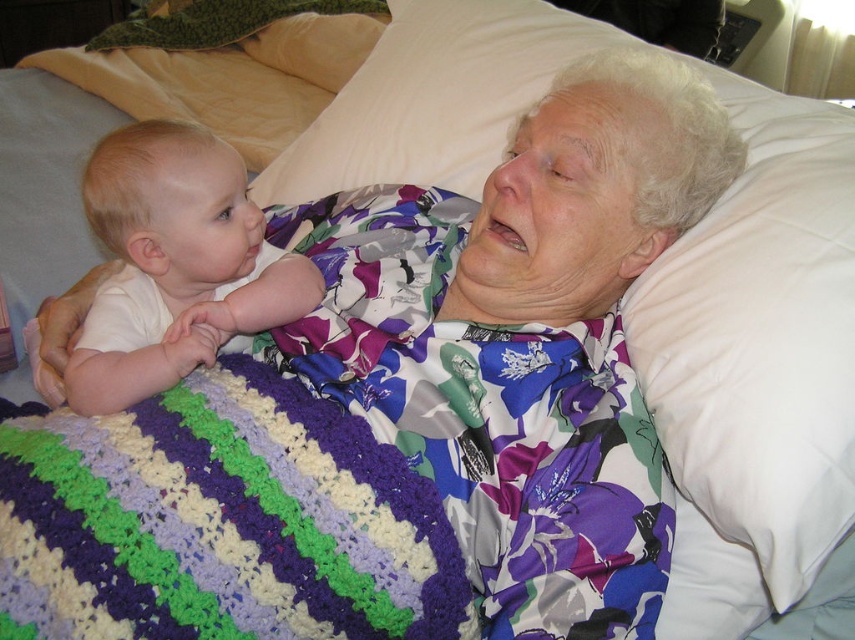
You are standing in the room and want to move from the point at coordinates point (423, 497) to the point at coordinates point (239, 316). Which direction should you move to get closer to the second point?

To move from point (423, 497) to point (239, 316), you should move towards the direction of the point at (239, 316). Since point (423, 497) is in front of point (239, 316), you need to move backward to reach the second point.

From the picture: You are a caregiver in a nursing home. You need to check if the white smooth baby at left is covered by the multicolored crocheted blanket at lower left. Based on the scene description, can you confirm if the baby is under the blanket?

The multicolored crocheted blanket at lower left is below the white smooth baby at left, so the baby is not under the blanket. The blanket is positioned beneath the baby, which means it is not covering the baby.

You are standing in a room and see a point marked at coordinates (x=27, y=524). If you want to reach this point without moving your feet, can you touch it with your outstretched hand?

The point at coordinates (x=27, y=524) is 28.61 inches from the viewer. Since an average person can reach about 28 inches with their arm, you might just barely touch it with your outstretched hand.